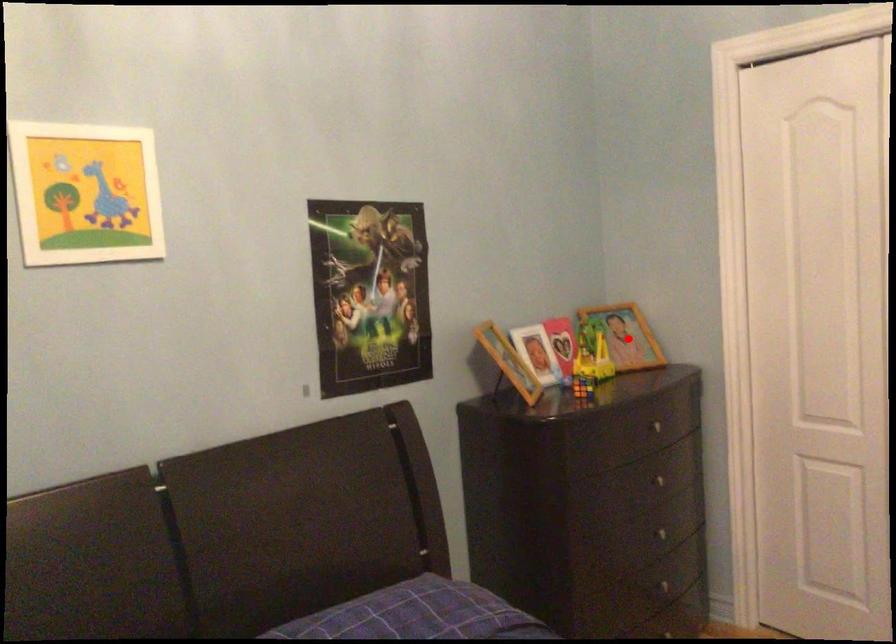
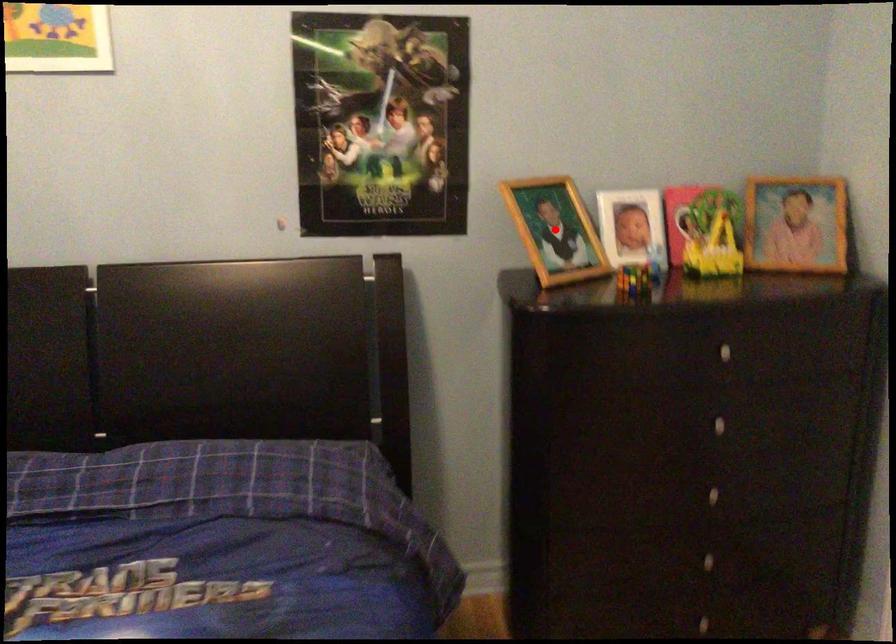
I am providing you with two images of the same scene from different viewpoints. A red point is marked on the first image and another point is marked on the second image. Is the marked point in image1 the same physical position as the marked point in image2?

No